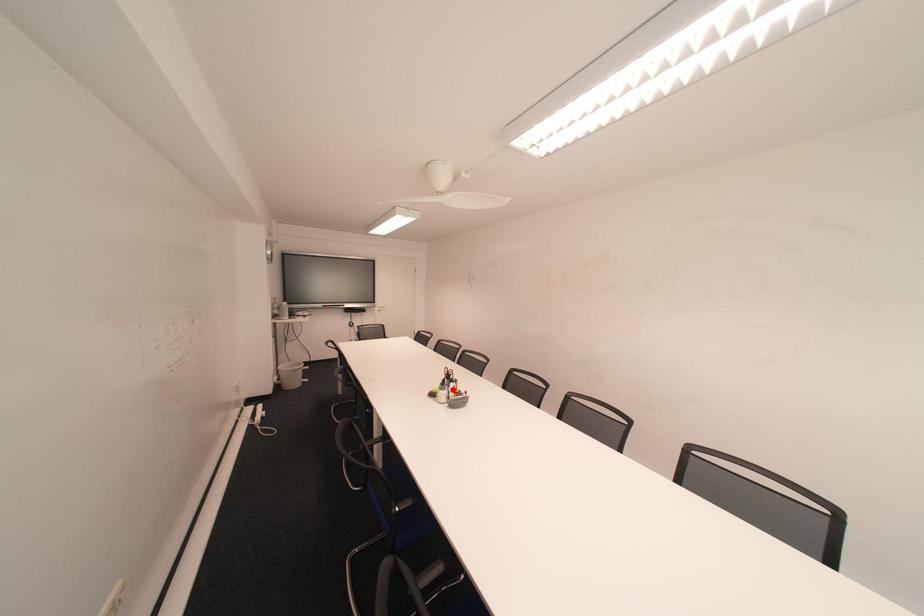
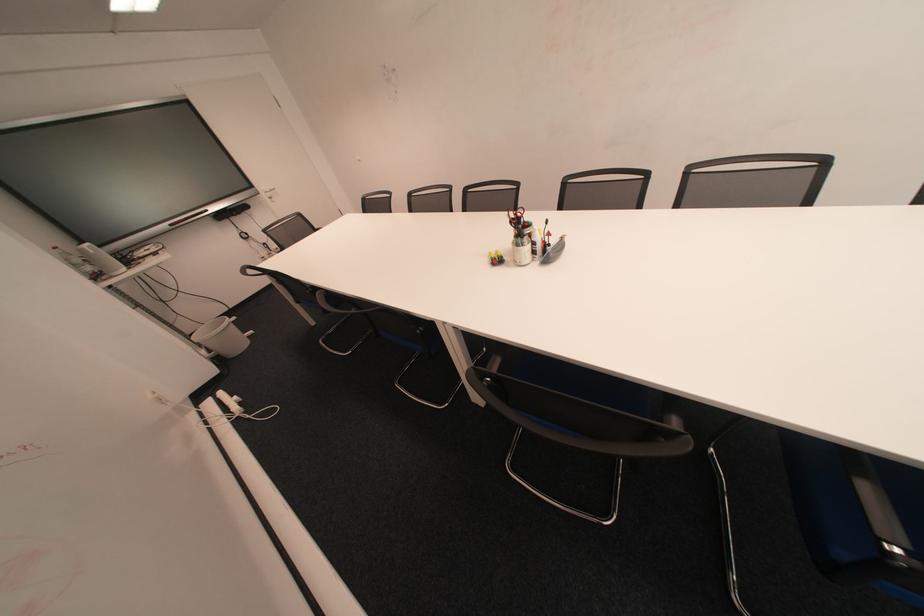
Question: I am providing you with two images of the same scene from different viewpoints. In image1, a red point is highlighted. Considering the same 3D point in image2, which of the following is correct?

Choices:
 (A) It is closer
 (B) It is farther

Answer: (A)